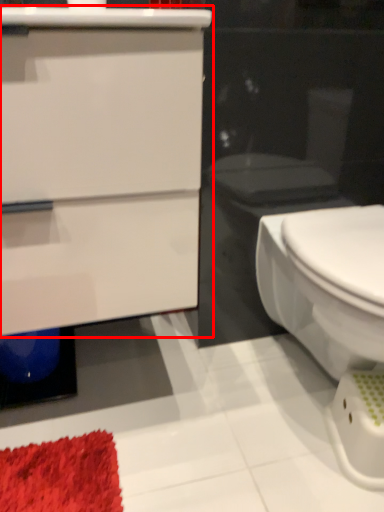
Question: From the image's perspective, where is bathroom cabinet (annotated by the red box) located relative to bidet?

Choices:
 (A) below
 (B) above

Answer: (B)